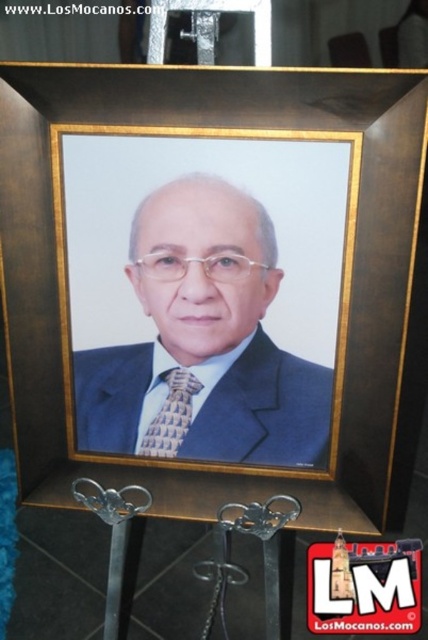
Question: Which object appears closest to the camera in this image?

Choices:
 (A) brown wooden picture frame at center
 (B) matte blue suit at center
 (C) gold textured tie at center

Answer: (A)

Question: Which of the following is the farthest from the observer?

Choices:
 (A) (410, 324)
 (B) (306, 400)

Answer: (A)

Question: Is matte blue suit at center in front of gold textured tie at center?

Choices:
 (A) no
 (B) yes

Answer: (B)

Question: Is the position of matte blue suit at center more distant than that of gold textured tie at center?

Choices:
 (A) no
 (B) yes

Answer: (A)

Question: In this image, where is brown wooden picture frame at center located relative to matte blue suit at center?

Choices:
 (A) left
 (B) right

Answer: (B)

Question: Which point is closer to the camera?

Choices:
 (A) gold textured tie at center
 (B) matte black suit at center
 (C) brown wooden picture frame at center
 (D) matte blue suit at center

Answer: (C)